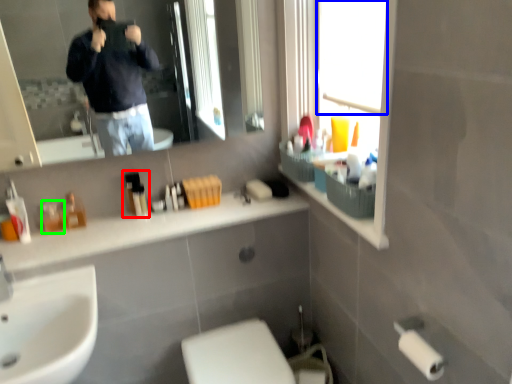
Question: Which object is the farthest from toiletry (highlighted by a red box)? Choose among these: window screen (highlighted by a blue box) or toiletry (highlighted by a green box).

Choices:
 (A) window screen
 (B) toiletry

Answer: (A)